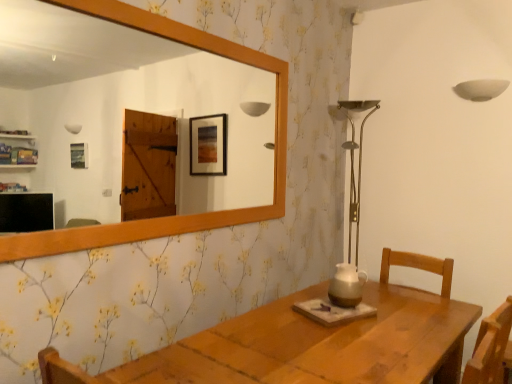
Identify the location of free space that is to the left of brown ceramic pitcher at center. The width and height of the screenshot is (512, 384). (314, 303).